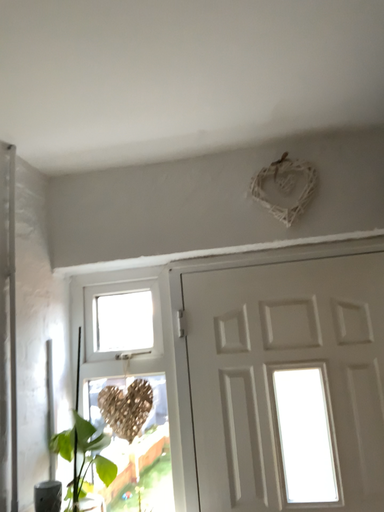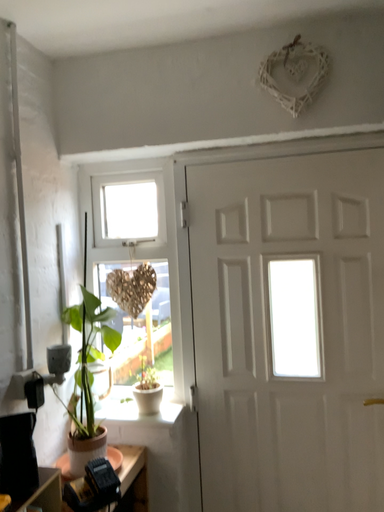
Question: Which way did the camera rotate in the video?

Choices:
 (A) rotated upward
 (B) rotated downward

Answer: (B)